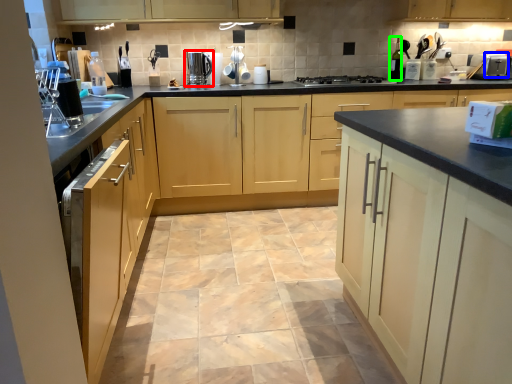
Question: Based on their relative distances, which object is nearer to home appliance (highlighted by a red box)? Choose from appliance (highlighted by a blue box) and bottle (highlighted by a green box).

Choices:
 (A) appliance
 (B) bottle

Answer: (B)